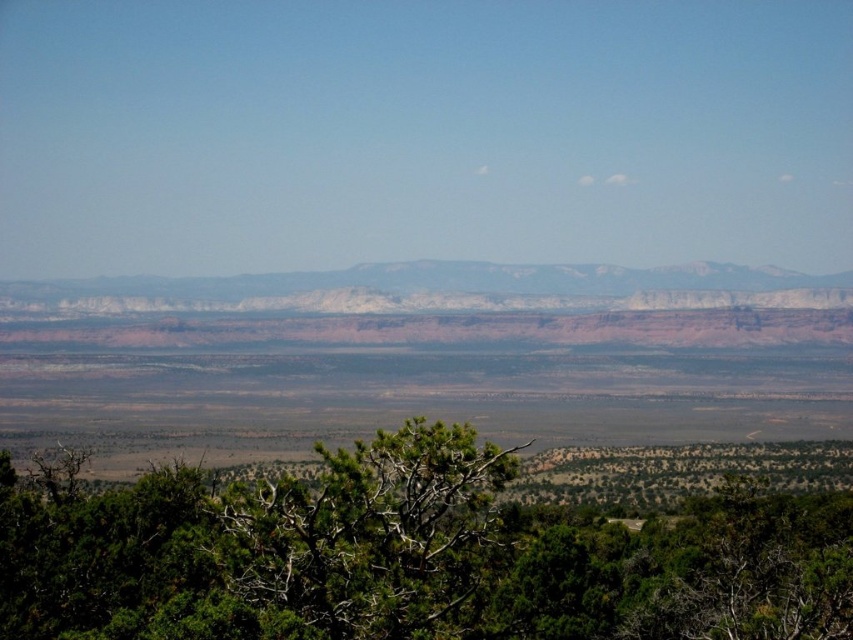
Does green leafy tree at center have a greater width compared to white sandstone mountains at center?

In fact, green leafy tree at center might be narrower than white sandstone mountains at center.

Between green leafy tree at center and white sandstone mountains at center, which one is positioned lower?

green leafy tree at center is below.

Is point (704, 557) positioned after point (84, 284)?

No, it is in front of (84, 284).

Where is `green leafy tree at center`? This screenshot has width=853, height=640. green leafy tree at center is located at coordinates (407, 556).